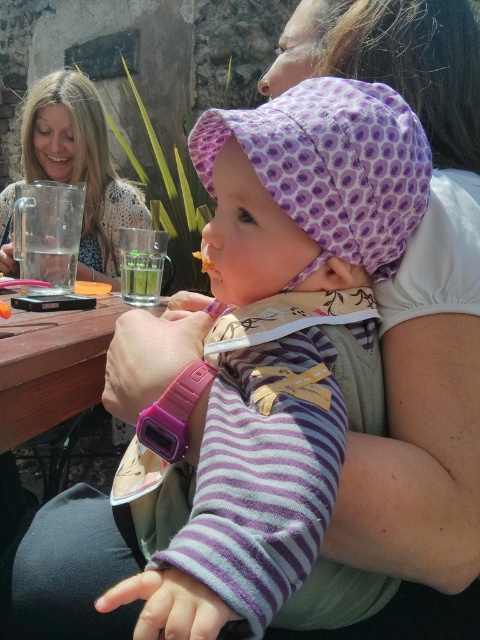
Question: Where is blonde hair at upper left located in relation to yellow crumbly food at center in the image?

Choices:
 (A) above
 (B) below

Answer: (A)

Question: Which of the following is the farthest from the observer?

Choices:
 (A) yellow crumbly food at center
 (B) brown wooden picnic table at lower left

Answer: (A)

Question: Which of the following is the closest to the observer?

Choices:
 (A) (67, 164)
 (B) (130, 285)

Answer: (B)

Question: Which of the following is the farthest from the observer?

Choices:
 (A) brown wooden picnic table at lower left
 (B) green leafy vegetable at center
 (C) blonde hair at upper left
 (D) yellow crumbly food at center

Answer: (D)

Question: Can you confirm if green leafy vegetable at center is positioned to the left of yellow crumbly food at center?

Choices:
 (A) yes
 (B) no

Answer: (B)

Question: Observing the image, what is the correct spatial positioning of brown wooden picnic table at lower left in reference to green leafy vegetable at center?

Choices:
 (A) above
 (B) below

Answer: (B)